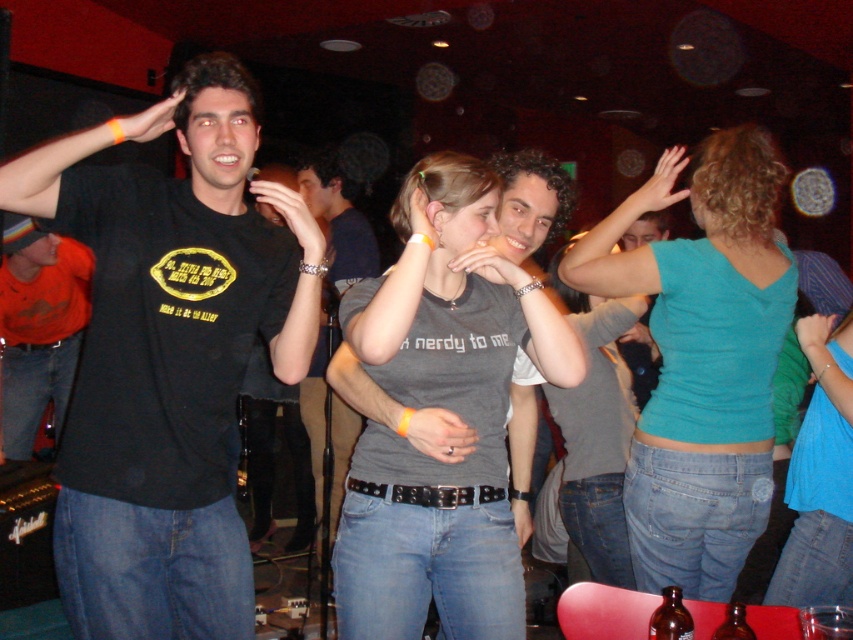
Can you confirm if black matte t-shirt at left is wider than teal matte tank top at center?

No, black matte t-shirt at left is not wider than teal matte tank top at center.

Is black matte t-shirt at left positioned in front of teal matte tank top at center?

Yes, it is.

Is point (253, 268) positioned after point (770, 438)?

No, it is in front of (770, 438).

Find the location of a particular element. The width and height of the screenshot is (853, 640). black matte t-shirt at left is located at coordinates (169, 355).

Is black matte t-shirt at left in front of matte gray shirt at center?

Yes.

Can you confirm if black matte t-shirt at left is thinner than matte gray shirt at center?

In fact, black matte t-shirt at left might be wider than matte gray shirt at center.

Which is behind, point (196, 68) or point (619, 410)?

The point (619, 410) is more distant.

Where is `black matte t-shirt at left`? Image resolution: width=853 pixels, height=640 pixels. black matte t-shirt at left is located at coordinates (169, 355).

Who is taller, black matte t-shirt at left or dark gray t-shirt at center?

With more height is black matte t-shirt at left.

Can you confirm if black matte t-shirt at left is smaller than dark gray t-shirt at center?

Actually, black matte t-shirt at left might be larger than dark gray t-shirt at center.

You are a GUI agent. You are given a task and a screenshot of the screen. Output one action in this format:
    pyautogui.click(x=<x>, y=<y>)
    Task: Click on the black matte t-shirt at left
    
    Given the screenshot: What is the action you would take?
    pyautogui.click(x=169, y=355)